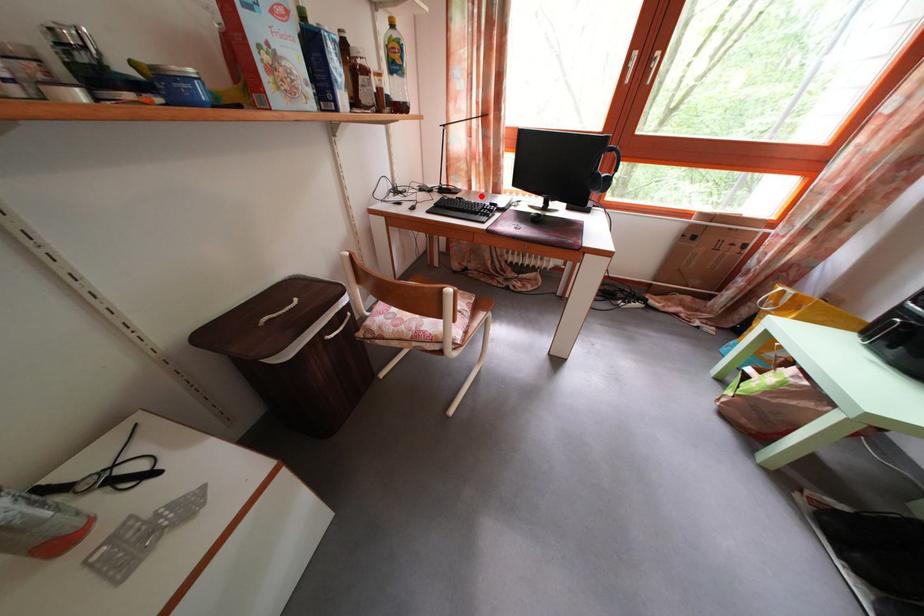
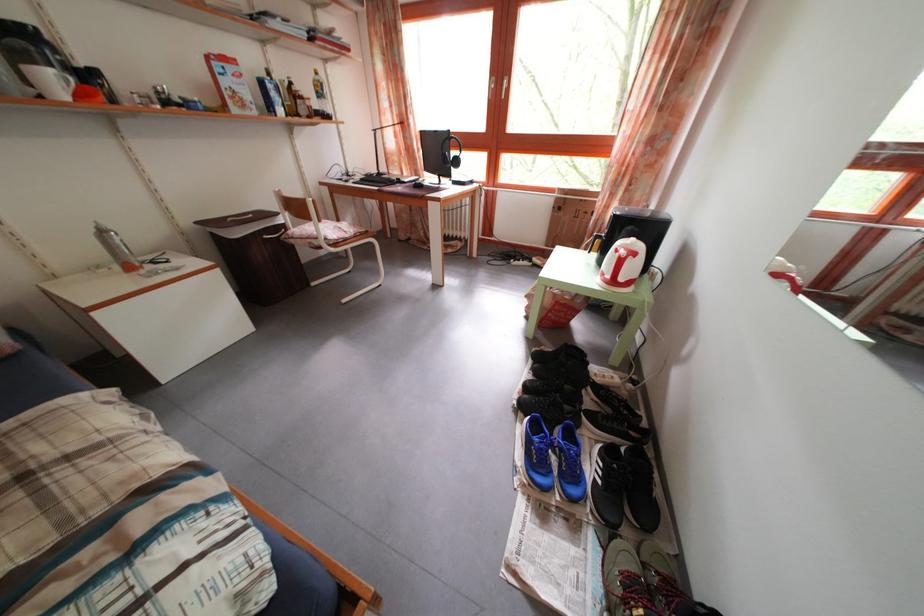
Find the pixel in the second image that matches the highlighted location in the first image.

(412, 182)